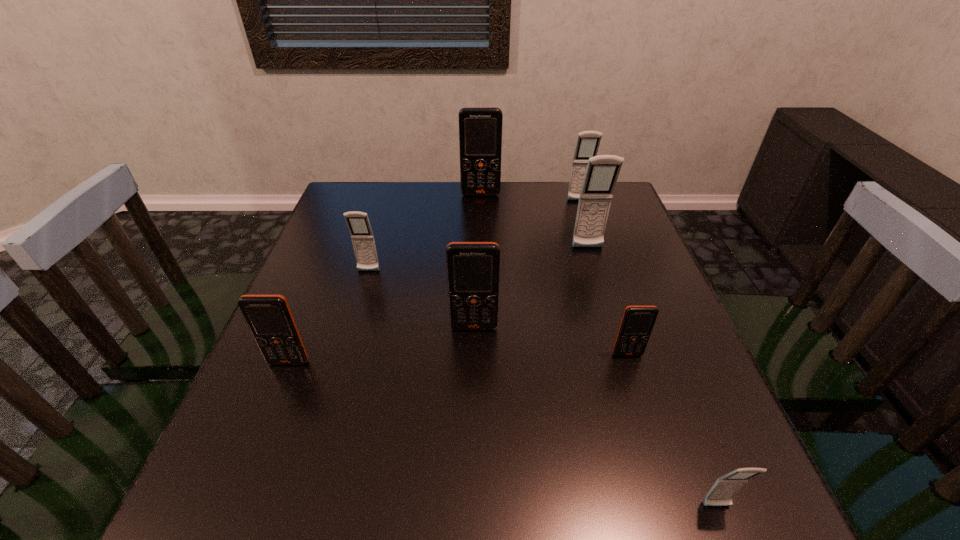
Where is `object identified as the closest to the seventh cellular telephone from right to left`? The height and width of the screenshot is (540, 960). object identified as the closest to the seventh cellular telephone from right to left is located at coordinates (473, 268).

Where is `cellular telephone that is the seventh nearest to the farthest orange cellular telephone`? The height and width of the screenshot is (540, 960). cellular telephone that is the seventh nearest to the farthest orange cellular telephone is located at coordinates 725,488.

Where is `cellular telephone that can be found as the sixth closest to the fifth farthest object`? This screenshot has width=960, height=540. cellular telephone that can be found as the sixth closest to the fifth farthest object is located at coordinates (480, 128).

Identify which orange cellular telephone is the closest to the third farthest object. Please provide its 2D coordinates. Your answer should be formatted as a tuple, i.e. [(x, y)], where the tuple contains the x and y coordinates of a point satisfying the conditions above.

[(480, 128)]

Identify which orange cellular telephone is located as the nearest to the seventh nearest object. Please provide its 2D coordinates. Your answer should be formatted as a tuple, i.e. [(x, y)], where the tuple contains the x and y coordinates of a point satisfying the conditions above.

[(480, 128)]

Find the location of `gray cellular telephone that stands as the closest to the smallest orange cellular telephone`. gray cellular telephone that stands as the closest to the smallest orange cellular telephone is located at coordinates (725, 488).

You are a GUI agent. You are given a task and a screenshot of the screen. Output one action in this format:
    pyautogui.click(x=<x>, y=<y>)
    Task: Click on the gray cellular telephone that is the closest one to the sixth nearest object
    
    Given the screenshot: What is the action you would take?
    pyautogui.click(x=588, y=142)